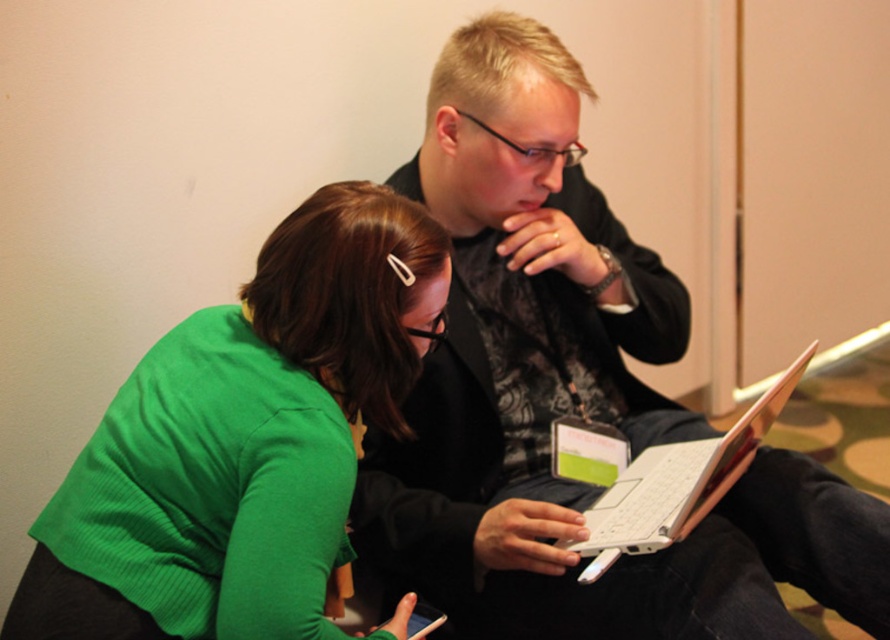
Based on the photo, can you confirm if green ribbed sweater at lower left is positioned above white plastic laptop at center?

Correct, green ribbed sweater at lower left is located above white plastic laptop at center.

What do you see at coordinates (244, 440) in the screenshot? I see `green ribbed sweater at lower left` at bounding box center [244, 440].

Find the location of a particular element. Image resolution: width=890 pixels, height=640 pixels. green ribbed sweater at lower left is located at coordinates (244, 440).

Identify the location of black matte laptop at center. (572, 396).

Between point (573, 81) and point (630, 488), which one is positioned in front?

Positioned in front is point (573, 81).

The image size is (890, 640). I want to click on black matte laptop at center, so click(572, 396).

Between black matte laptop at center and green ribbed sweater at lower left, which one is positioned higher?

black matte laptop at center is higher up.

Is point (434, 422) closer to viewer compared to point (316, 600)?

That is False.

The width and height of the screenshot is (890, 640). Identify the location of black matte laptop at center. (572, 396).